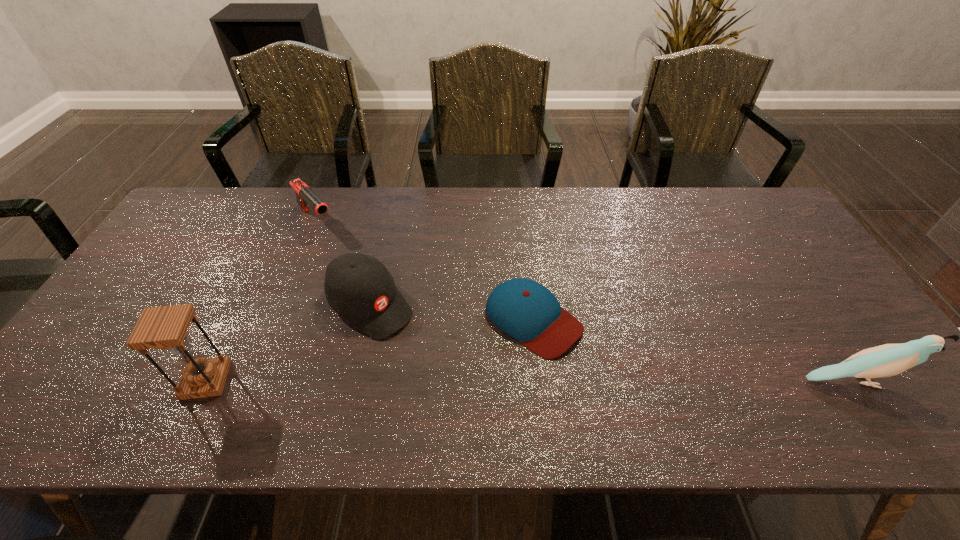
Identify the location of free point that satisfies the following two spatial constraints: 1. on the front side of the farthest object; 2. on the left side of the shorter baseball cap. 276,320.

The image size is (960, 540). What are the coordinates of `blank area in the image that satisfies the following two spatial constraints: 1. on the front side of the bird; 2. at the face of the fourth object from left to right` in the screenshot? It's located at (540, 381).

I want to click on free location that satisfies the following two spatial constraints: 1. on the front side of the shortest object; 2. on the right side of the third object from right to left, so click(368, 320).

Where is `vacant area that satisfies the following two spatial constraints: 1. on the front side of the third object from right to left; 2. at the face of the fourth shortest object`? The height and width of the screenshot is (540, 960). vacant area that satisfies the following two spatial constraints: 1. on the front side of the third object from right to left; 2. at the face of the fourth shortest object is located at coordinates (353, 381).